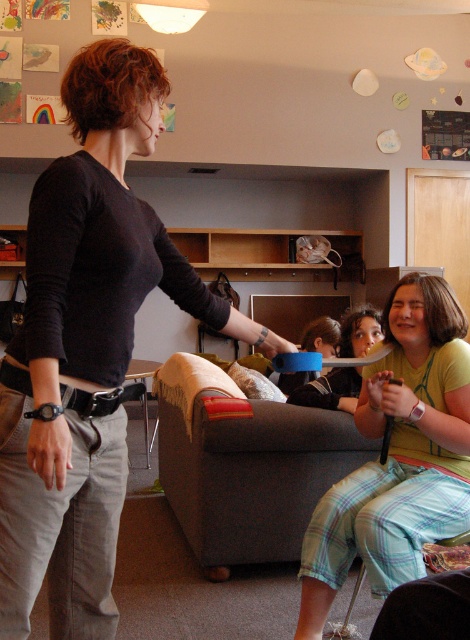
Can you confirm if light green cotton shirt at center is thinner than gray fabric couch at center?

Correct, light green cotton shirt at center's width is less than gray fabric couch at center's.

What do you see at coordinates (399, 456) in the screenshot? The image size is (470, 640). I see `light green cotton shirt at center` at bounding box center [399, 456].

This screenshot has height=640, width=470. In order to click on light green cotton shirt at center in this screenshot , I will do `click(399, 456)`.

Can you confirm if matte black shirt at center is wider than gray fabric couch at center?

In fact, matte black shirt at center might be narrower than gray fabric couch at center.

Between point (115, 188) and point (249, 426), which one is positioned behind?

Point (249, 426)

Measure the distance between matte black shirt at center and camera.

matte black shirt at center is 1.17 meters from camera.

Identify the location of matte black shirt at center. (86, 348).

Is point (100, 586) positioned in front of point (430, 403)?

That is True.

Is matte black shirt at center to the left of light green cotton shirt at center from the viewer's perspective?

Indeed, matte black shirt at center is positioned on the left side of light green cotton shirt at center.

Is point (1, 572) behind point (371, 365)?

No, it is not.

I want to click on matte black shirt at center, so click(x=86, y=348).